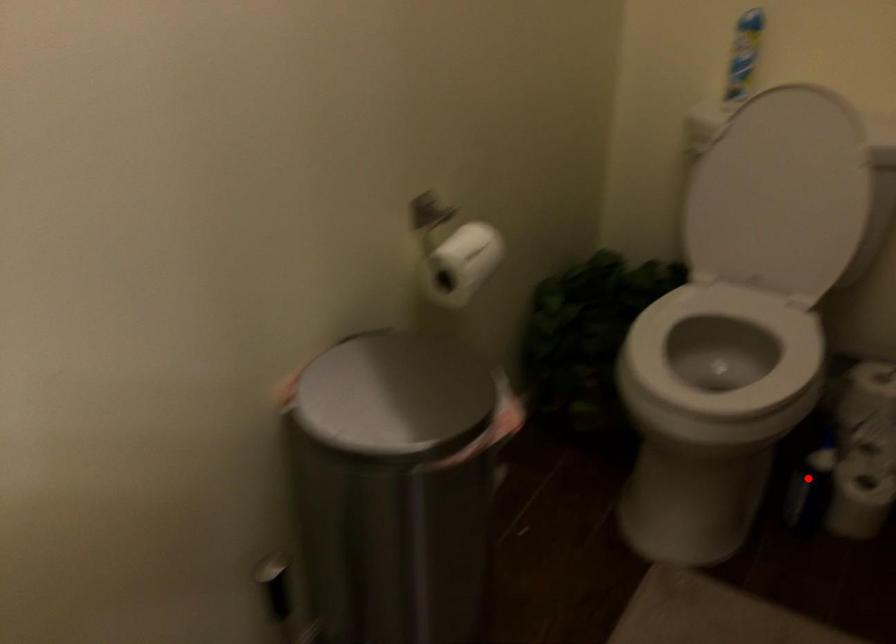
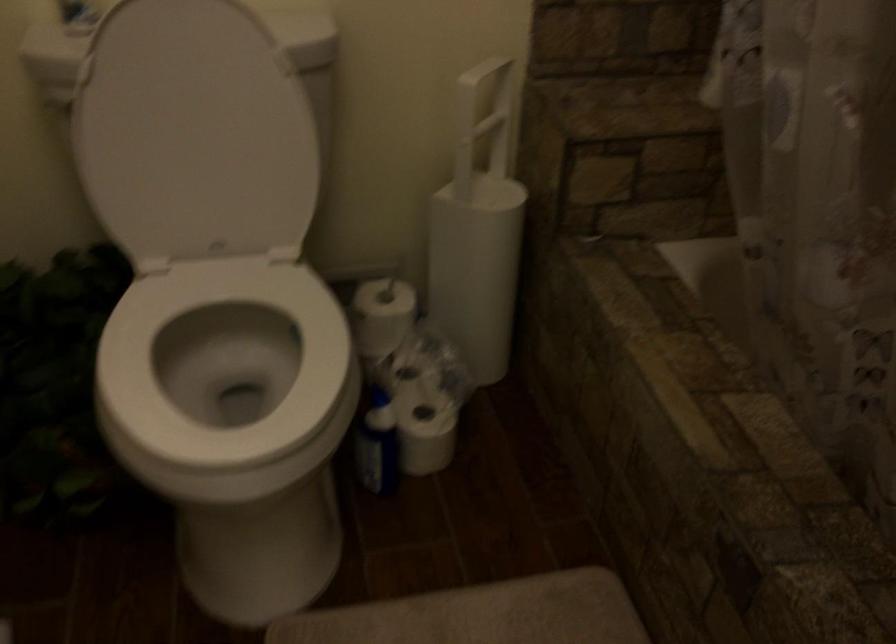
Question: I am providing you with two images of the same scene from different viewpoints. A red point is shown in image1. For the corresponding object point in image2, is it positioned nearer or farther from the camera?

Choices:
 (A) Nearer
 (B) Farther

Answer: (A)